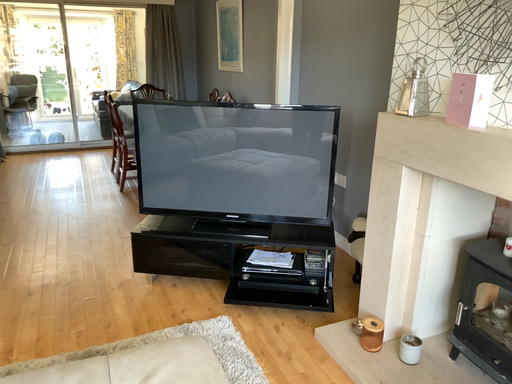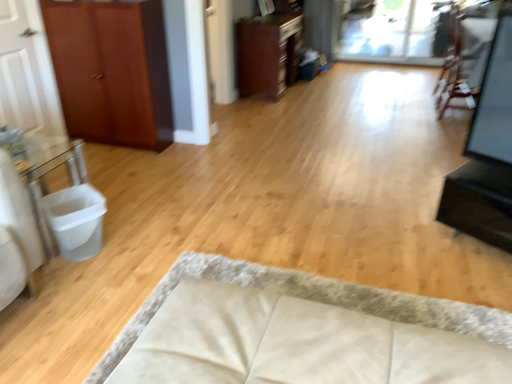
Question: How did the camera likely rotate when shooting the video?

Choices:
 (A) rotated right
 (B) rotated left

Answer: (B)